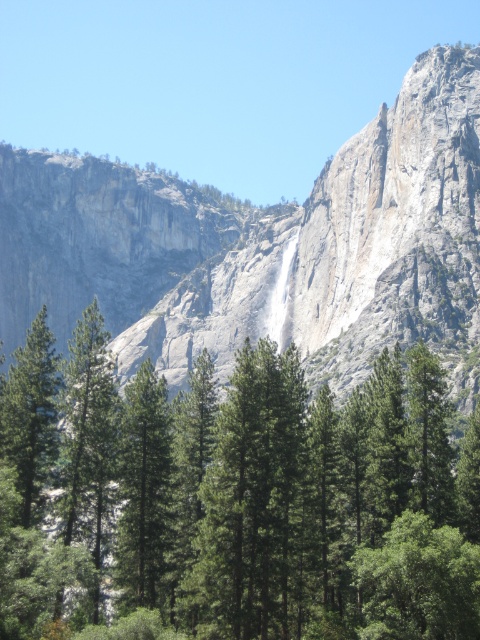
You are standing at the camera position and want to reach the point marked at coordinates point (x=268, y=612). Given that the path to this point is 65.05 meters long, can you estimate whether you can reach it within 10 minutes if you walk at an average speed of 3 meters per minute?

The distance to point (x=268, y=612) is 65.05 meters. At a walking speed of 3 meters per minute, it would take approximately 21.68 minutes to reach it. Therefore, you cannot reach it within 10 minutes.

In the scene shown: You are an environmental scientist assessing the landscape. You need to determine which area is narrower between the green textured pine trees at center and the gray rock face at center. Which one is narrower?

The green textured pine trees at center has a lesser width compared to the gray rock face at center, so the green textured pine trees at center is narrower.

You are a hiker standing at the bottom of the waterfall in the midground. You want to reach the green textured pine trees at center. Which direction should you move to get closer to them?

The green textured pine trees at center are located at point 0.777 on the x axis and 0.492 on the y axis. Since you are at the bottom of the waterfall in the midground, you should move towards the center of the image to reach them.